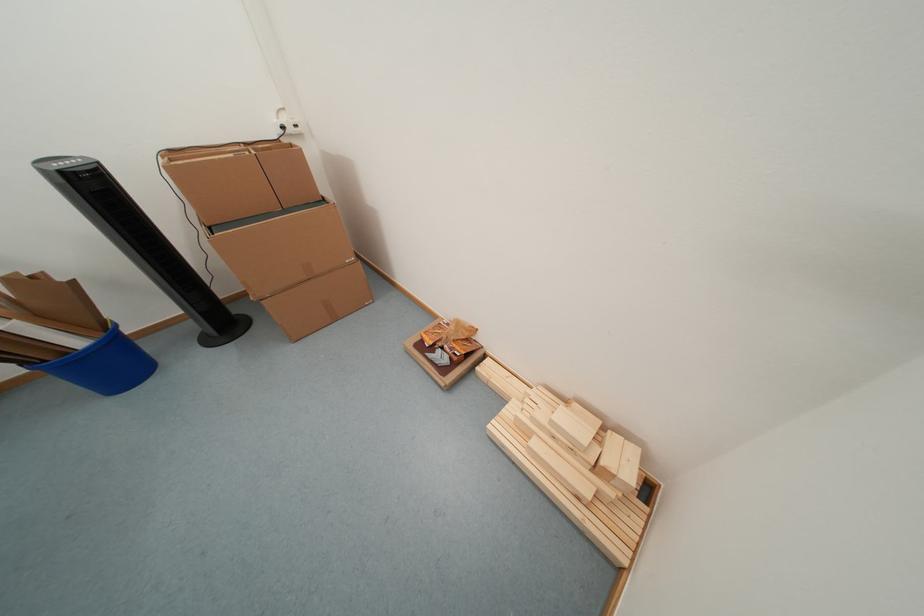
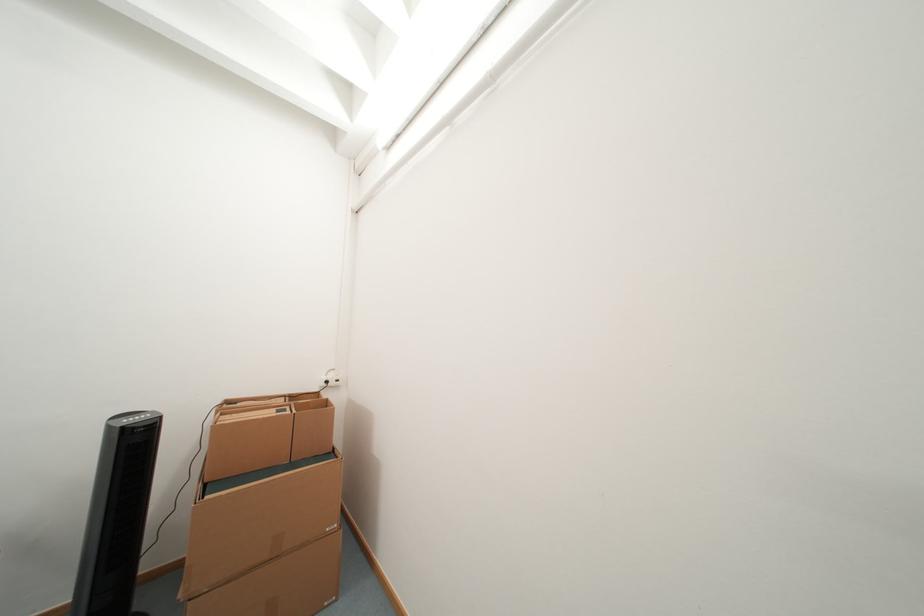
Question: Based on the continuous images, in which direction is the camera rotating? Reply with the corresponding letter.

Choices:
 (A) Left
 (B) Right
 (C) Up
 (D) Down

Answer: (C)